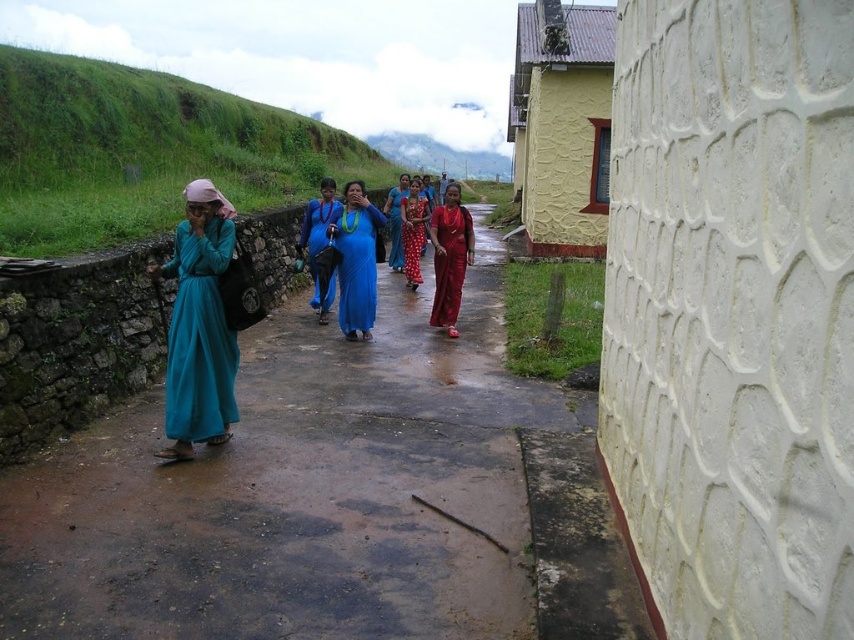
Can you confirm if teal fabric dress at left is shorter than shiny red dress at center?

No, teal fabric dress at left is not shorter than shiny red dress at center.

Image resolution: width=854 pixels, height=640 pixels. What do you see at coordinates (199, 326) in the screenshot? I see `teal fabric dress at left` at bounding box center [199, 326].

Who is more forward, (165, 419) or (457, 252)?

Point (165, 419) is more forward.

I want to click on teal fabric dress at left, so click(x=199, y=326).

Describe the element at coordinates (319, 243) in the screenshot. The width and height of the screenshot is (854, 640). I see `blue fabric dress at center` at that location.

Between point (320, 310) and point (419, 278), which one is positioned behind?

Point (419, 278)

Identify the location of blue fabric dress at center. (x=319, y=243).

Find the location of a particular element. This screenshot has width=854, height=640. blue fabric dress at center is located at coordinates (319, 243).

Who is shorter, shiny red dress at center or blue silk saree at center?

With less height is blue silk saree at center.

Does shiny red dress at center lie in front of blue silk saree at center?

Yes, shiny red dress at center is closer to the viewer.

Is point (457, 252) positioned behind point (396, 253)?

No.

Where is `shiny red dress at center`? This screenshot has width=854, height=640. shiny red dress at center is located at coordinates (449, 257).